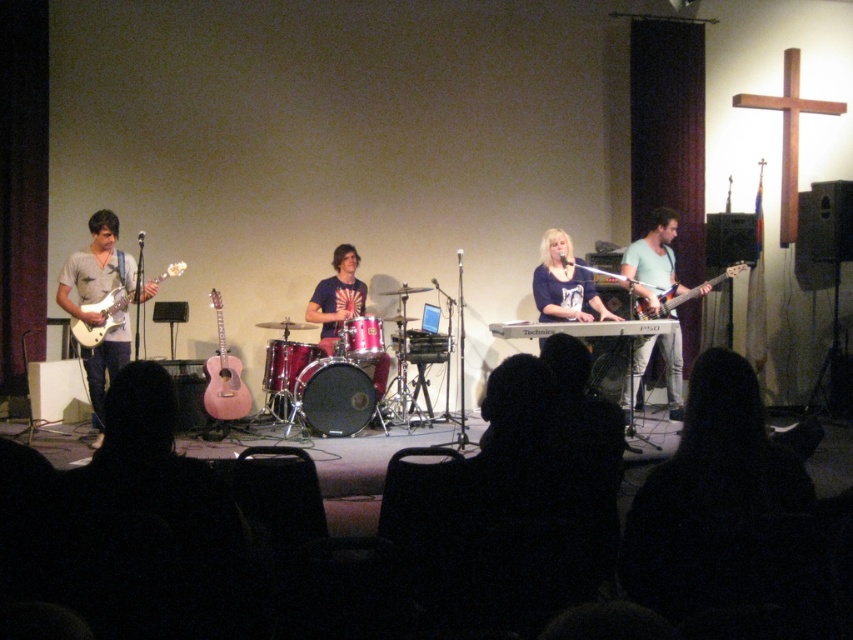
Is shiny red drum set at center shorter than white glossy electric guitar at left?

No.

Does shiny red drum set at center come behind white glossy electric guitar at left?

Yes, shiny red drum set at center is further from the viewer.

Is point (349, 252) positioned in front of point (86, 304)?

No, (349, 252) is further to viewer.

You are a GUI agent. You are given a task and a screenshot of the screen. Output one action in this format:
    pyautogui.click(x=<x>, y=<y>)
    Task: Click on the shiny red drum set at center
    The width and height of the screenshot is (853, 640).
    Given the screenshot: What is the action you would take?
    pyautogui.click(x=337, y=298)

Is point (746, 264) positioned after point (379, 326)?

Yes, point (746, 264) is behind point (379, 326).

Is glossy electric guitar at right smaller than metallic drum at center?

Incorrect, glossy electric guitar at right is not smaller in size than metallic drum at center.

From the picture: Measure the distance between point (672, 291) and camera.

20.53 feet

This screenshot has width=853, height=640. What are the coordinates of `glossy electric guitar at right` in the screenshot? It's located at (682, 294).

Does point (670, 348) come closer to viewer compared to point (90, 346)?

No, it is behind (90, 346).

Who is positioned more to the left, matte light blue shirt at right or white glossy electric guitar at left?

white glossy electric guitar at left is more to the left.

In order to click on matte light blue shirt at right in this screenshot , I will do `click(653, 260)`.